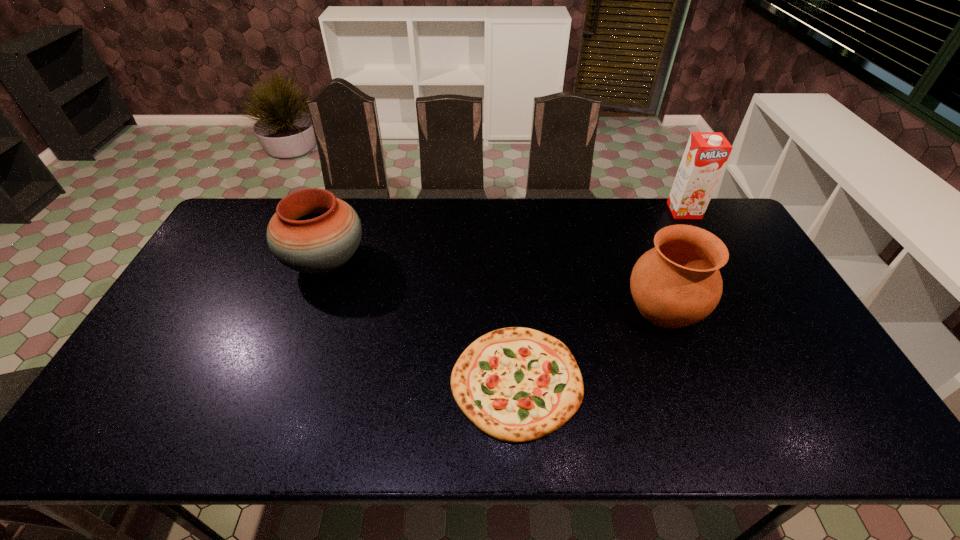
At what (x,y) coordinates should I click in order to perform the action: click on free spot that satisfies the following two spatial constraints: 1. on the back side of the leftmost object; 2. on the left side of the rightmost object. Please return your answer as a coordinate pair (x, y). Looking at the image, I should click on (344, 211).

What are the coordinates of `vacant position in the image that satisfies the following two spatial constraints: 1. on the back side of the leftmost object; 2. on the left side of the tallest object` in the screenshot? It's located at (344, 211).

Image resolution: width=960 pixels, height=540 pixels. Identify the location of free point that satisfies the following two spatial constraints: 1. on the front side of the leftmost object; 2. on the right side of the right pottery. (309, 308).